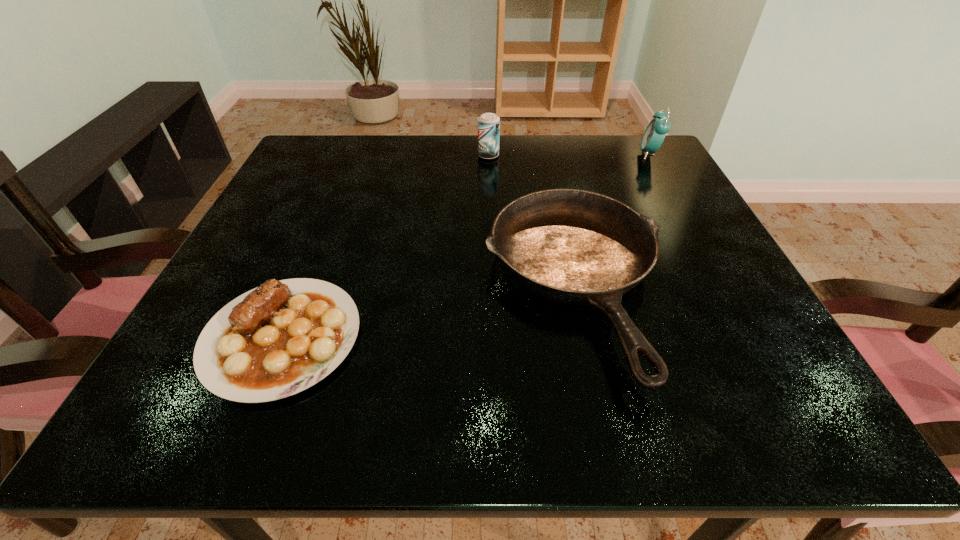
You are a GUI agent. You are given a task and a screenshot of the screen. Output one action in this format:
    pyautogui.click(x=<x>, y=<y>)
    Task: Click on the blank region between the alarm clock and the steak
    
    Given the screenshot: What is the action you would take?
    pyautogui.click(x=466, y=246)

Locate an element on the screen. vacant space in between the frying pan and the shortest object is located at coordinates click(429, 313).

The width and height of the screenshot is (960, 540). In order to click on vacant region between the leftmost object and the beer can in this screenshot , I will do `click(385, 247)`.

What are the coordinates of `vacant area that lies between the steak and the second shortest object` in the screenshot? It's located at (429, 313).

Where is `vacant point located between the leftmost object and the beer can`? vacant point located between the leftmost object and the beer can is located at coordinates click(x=385, y=247).

Identify the location of free space between the rightmost object and the beer can. The height and width of the screenshot is (540, 960). [x=569, y=155].

Identify the location of object identified as the second closest to the leftmost object. (488, 123).

Where is `object identified as the second closest to the frying pan`? object identified as the second closest to the frying pan is located at coordinates (488, 123).

Where is `vacant space that satisfies the following two spatial constraints: 1. on the face of the alarm clock; 2. on the front side of the frying pan`? vacant space that satisfies the following two spatial constraints: 1. on the face of the alarm clock; 2. on the front side of the frying pan is located at coordinates (724, 287).

At what (x,y) coordinates should I click in order to perform the action: click on vacant space that satisfies the following two spatial constraints: 1. on the face of the rightmost object; 2. on the front side of the leftmost object. Please return your answer as a coordinate pair (x, y). The width and height of the screenshot is (960, 540). Looking at the image, I should click on (753, 338).